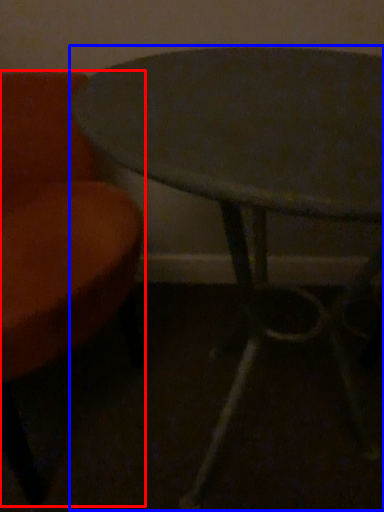
Question: Among these objects, which one is nearest to the camera, chair (highlighted by a red box) or table (highlighted by a blue box)?

Choices:
 (A) chair
 (B) table

Answer: (A)